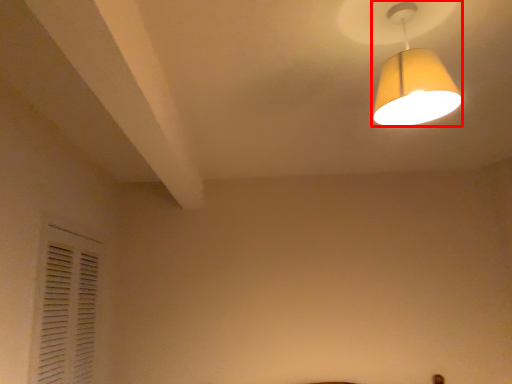
Question: From the image, what is the correct spatial relationship of lamp (annotated by the red box) in relation to shutter?

Choices:
 (A) right
 (B) left

Answer: (A)